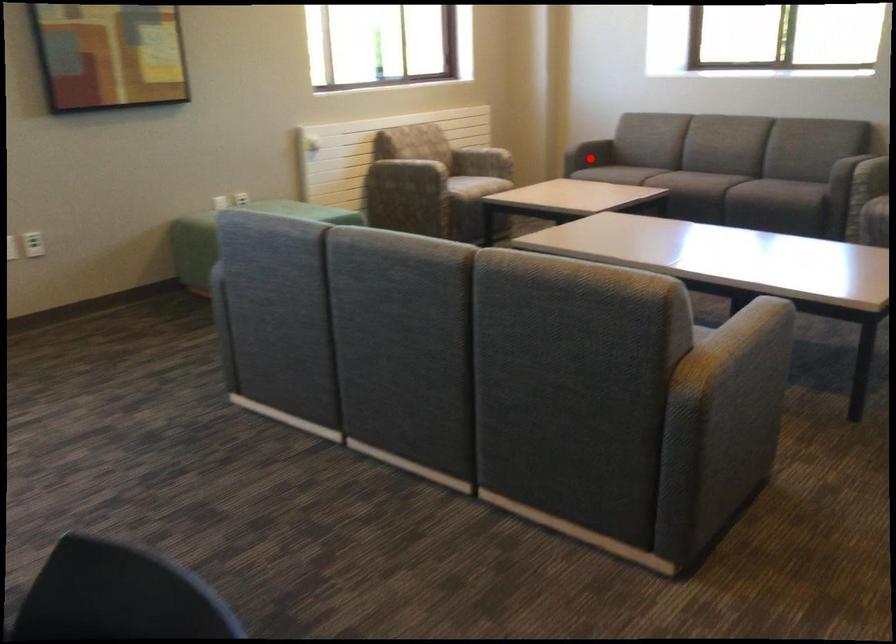
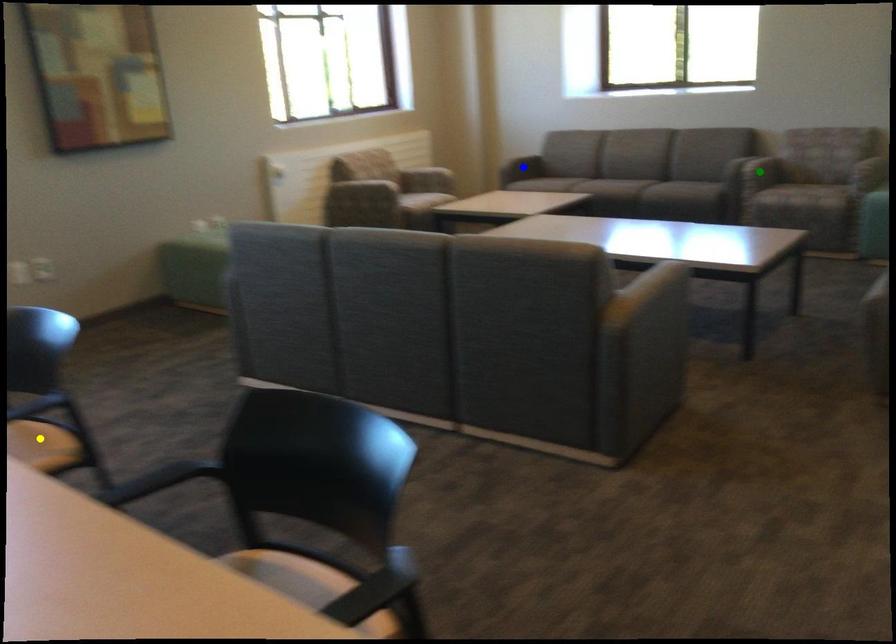
Question: I am providing you with two images of the same scene from different viewpoints. A red point is marked on the first image. You are given multiple points on the second image. Which mark in image 2 goes with the point in image 1?

Choices:
 (A) blue point
 (B) green point
 (C) yellow point

Answer: (A)